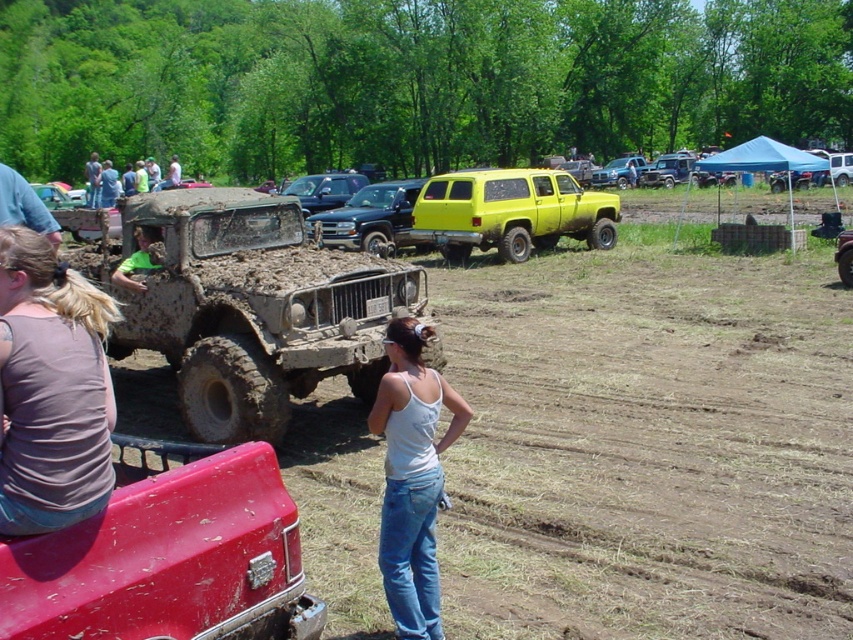
Between matte pink tank top at lower left and shiny blue truck at center, which one appears on the right side from the viewer's perspective?

matte pink tank top at lower left is more to the right.

Who is lower down, matte pink tank top at lower left or shiny blue truck at center?

matte pink tank top at lower left

The image size is (853, 640). I want to click on matte pink tank top at lower left, so click(51, 388).

Which is in front, point (113, 312) or point (326, 220)?

Point (113, 312) is in front.

The image size is (853, 640). Describe the element at coordinates (51, 388) in the screenshot. I see `matte pink tank top at lower left` at that location.

Who is more forward, (79, 384) or (393, 182)?

Point (79, 384)

Locate an element on the screen. The width and height of the screenshot is (853, 640). matte pink tank top at lower left is located at coordinates (51, 388).

Which of these two, muddy rubber truck at left or yellow matte suv at center, stands taller?

With more height is muddy rubber truck at left.

This screenshot has width=853, height=640. What are the coordinates of `muddy rubber truck at left` in the screenshot? It's located at (247, 305).

Where is `muddy rubber truck at left`? muddy rubber truck at left is located at coordinates (247, 305).